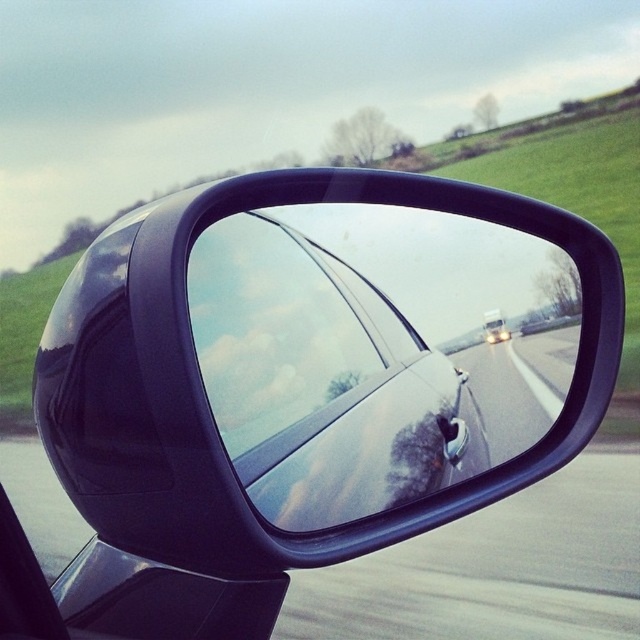
Can you confirm if transparent glass car window at center is smaller than white glossy car at center?

No.

Where is `transparent glass car window at center`? transparent glass car window at center is located at coordinates (272, 333).

Is glossy black mirror at center to the left of glossy asphalt road at center from the viewer's perspective?

Indeed, glossy black mirror at center is positioned on the left side of glossy asphalt road at center.

Is point (460, 304) positioned behind point (522, 419)?

No, (460, 304) is in front of (522, 419).

This screenshot has width=640, height=640. Identify the location of glossy black mirror at center. 376,353.

Between transparent glass car window at center and glossy asphalt road at center, which one appears on the left side from the viewer's perspective?

transparent glass car window at center is more to the left.

How much distance is there between transparent glass car window at center and glossy asphalt road at center?

A distance of 47.57 centimeters exists between transparent glass car window at center and glossy asphalt road at center.

Is point (305, 356) farther from viewer compared to point (486, 403)?

That is False.

Find the location of `transparent glass car window at center`. transparent glass car window at center is located at coordinates (272, 333).